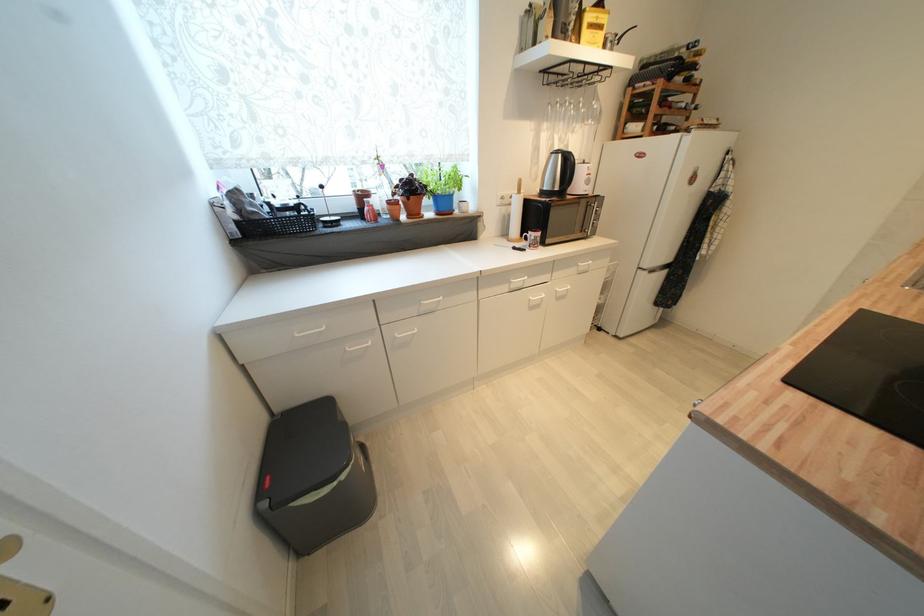
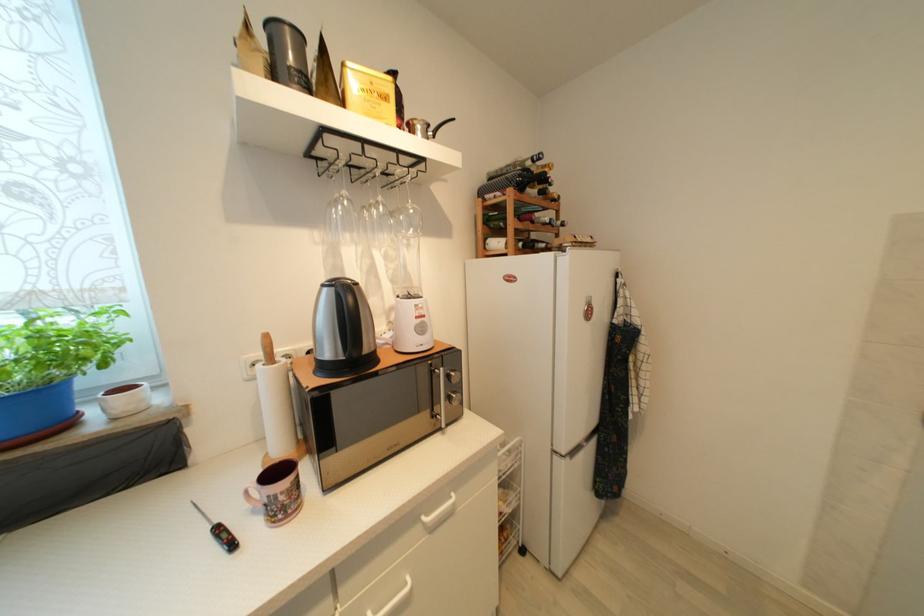
In a continuous first-person perspective shot, in which direction is the camera moving?

The cameraman walked toward right, forward.